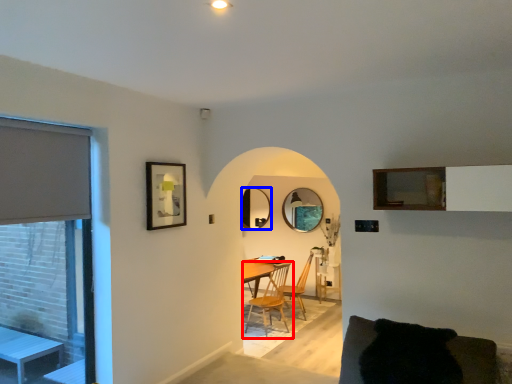
Question: Which point is further to the camera, chair (highlighted by a red box) or mirror (highlighted by a blue box)?

Choices:
 (A) chair
 (B) mirror

Answer: (B)